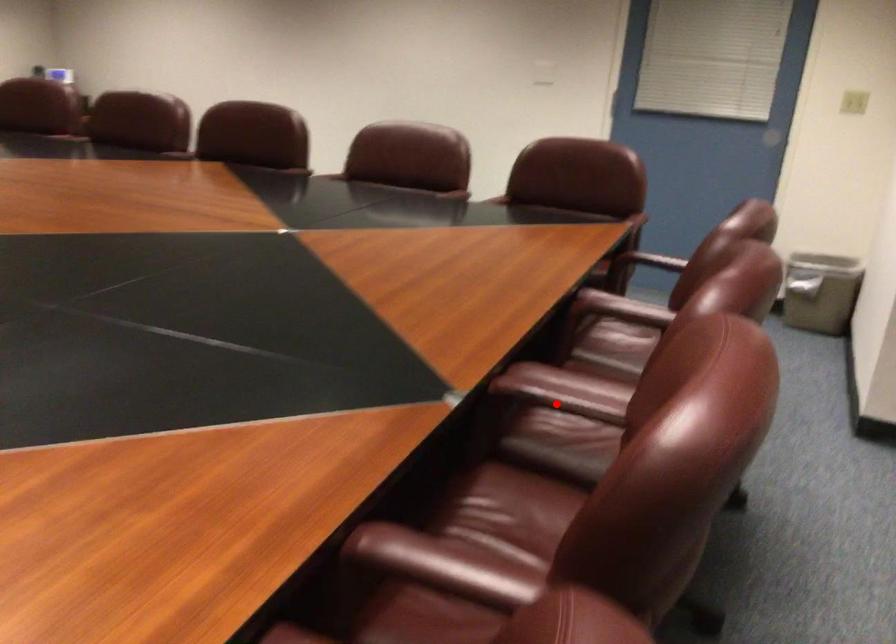
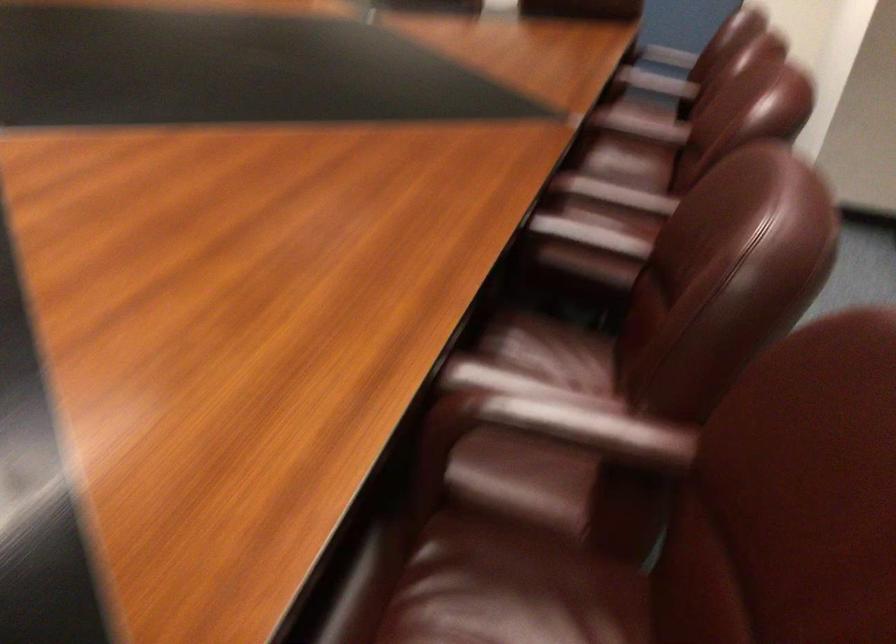
Question: I am providing you with two images of the same scene from different viewpoints. Image1 has a red point marked. In image2, the corresponding 3D location appears at what relative position? Reply with the corresponding letter.

Choices:
 (A) Closer
 (B) Farther

Answer: (B)